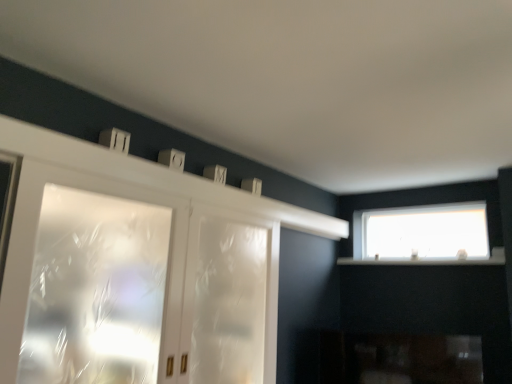
In order to face transparent glass window at upper right, the second window from the front, should I rotate leftwards or rightwards?

To align with it, rotate right about 21.423°.

Where is `frosted glass cabinet at left, which appears as the 1th window when viewed from the left`? frosted glass cabinet at left, which appears as the 1th window when viewed from the left is located at coordinates (95, 290).

Can you confirm if transparent plastic screen door at center is taller than transparent glass window at upper right, the second window from the front?

Correct, transparent plastic screen door at center is much taller as transparent glass window at upper right, the second window from the front.

Is transparent plastic screen door at center in front of or behind transparent glass window at upper right, the first window from the right, in the image?

transparent plastic screen door at center is positioned closer to the viewer than transparent glass window at upper right, the first window from the right.

Is transparent plastic screen door at center beside transparent glass window at upper right, which is the 1th window from back to front?

There is a gap between transparent plastic screen door at center and transparent glass window at upper right, which is the 1th window from back to front.

Is point (227, 311) positioned behind point (374, 258)?

That is False.

How many degrees apart are the facing directions of frosted glass cabinet at left, which appears as the 1th window when viewed from the left, and transparent glass window at upper right, the second window positioned from the left?

90.5 degrees.

Looking at this image, considering the sizes of objects frosted glass cabinet at left, which appears as the first window when viewed from the front, and transparent glass window at upper right, which is the 1th window from back to front, in the image provided, who is bigger, frosted glass cabinet at left, which appears as the first window when viewed from the front, or transparent glass window at upper right, which is the 1th window from back to front,?

frosted glass cabinet at left, which appears as the first window when viewed from the front, is bigger.

Is frosted glass cabinet at left, the 2th window positioned from the right, oriented towards transparent glass window at upper right, the second window from the front?

No.

Is frosted glass cabinet at left, the 2th window positioned from the right, located outside transparent glass window at upper right, the second window from the front?

That's correct, frosted glass cabinet at left, the 2th window positioned from the right, is outside of transparent glass window at upper right, the second window from the front.

From a real-world perspective, which object stands above the other?

From a 3D spatial view, white matte mantle at upper center is above.

From the image's perspective, which one is positioned higher, white matte mantle at upper center or transparent glass window at upper right, the first window from the right?

white matte mantle at upper center appears higher in the image.

Considering the sizes of objects white matte mantle at upper center and transparent glass window at upper right, the first window from the right, in the image provided, who is wider, white matte mantle at upper center or transparent glass window at upper right, the first window from the right,?

With larger width is white matte mantle at upper center.

How much distance is there between white matte mantle at upper center and transparent glass window at upper right, the second window positioned from the left?

They are 1.08 meters apart.

Is frosted glass cabinet at left, acting as the second window starting from the back, inside the boundaries of white matte mantle at upper center, or outside?

frosted glass cabinet at left, acting as the second window starting from the back, lies outside white matte mantle at upper center.

Does frosted glass cabinet at left, the 2th window positioned from the right, have a greater width compared to white matte mantle at upper center?

No.

Identify the location of mantle that appears above the frosted glass cabinet at left, which appears as the 1th window when viewed from the left (from a real-world perspective). (x=155, y=176).

Who is taller, frosted glass cabinet at left, acting as the second window starting from the back, or white matte mantle at upper center?

With more height is frosted glass cabinet at left, acting as the second window starting from the back.

Does point (103, 166) come in front of point (137, 248)?

Yes, it is in front of point (137, 248).

Between white matte mantle at upper center and frosted glass cabinet at left, which appears as the first window when viewed from the front, which one has more height?

Standing taller between the two is frosted glass cabinet at left, which appears as the first window when viewed from the front.

From the picture: Is transparent glass window at upper right, the second window positioned from the left, wider or thinner than frosted glass cabinet at left, acting as the second window starting from the back?

In the image, transparent glass window at upper right, the second window positioned from the left, appears to be more narrow than frosted glass cabinet at left, acting as the second window starting from the back.

How different are the orientations of transparent glass window at upper right, the second window positioned from the left, and frosted glass cabinet at left, which appears as the 1th window when viewed from the left, in degrees?

They differ by 90.5 degrees in their facing directions.

From a real-world perspective, between transparent glass window at upper right, the first window from the right, and frosted glass cabinet at left, the 2th window positioned from the right, who is vertically lower?

frosted glass cabinet at left, the 2th window positioned from the right, is physically lower.

Could you tell me if transparent glass window at upper right, which is the 1th window from back to front, is turned towards frosted glass cabinet at left, which appears as the first window when viewed from the front?

Yes, transparent glass window at upper right, which is the 1th window from back to front, is turned towards frosted glass cabinet at left, which appears as the first window when viewed from the front.

Is frosted glass cabinet at left, which appears as the first window when viewed from the front, to the left or to the right of transparent plastic screen door at center in the image?

Clearly, frosted glass cabinet at left, which appears as the first window when viewed from the front, is on the left of transparent plastic screen door at center in the image.

From a real-world perspective, is frosted glass cabinet at left, the 2th window positioned from the right, beneath transparent plastic screen door at center?

No, from a real-world perspective, frosted glass cabinet at left, the 2th window positioned from the right, is not below transparent plastic screen door at center.

Between frosted glass cabinet at left, which appears as the 1th window when viewed from the left, and transparent plastic screen door at center, which one has larger size?

transparent plastic screen door at center.

What are the coordinates of `screen door that appears on the left of transparent glass window at upper right, the second window from the front` in the screenshot? It's located at (229, 298).

What are the coordinates of `window lying above the frosted glass cabinet at left, the 2th window positioned from the right (from the image's perspective)` in the screenshot? It's located at (422, 233).

Estimate the real-world distances between objects in this image. Which object is closer to frosted glass cabinet at left, which appears as the first window when viewed from the front, transparent glass window at upper right, the first window from the right, or white matte mantle at upper center?

white matte mantle at upper center lies closer to frosted glass cabinet at left, which appears as the first window when viewed from the front, than the other object.

Estimate the real-world distances between objects in this image. Which object is further from white matte mantle at upper center, frosted glass cabinet at left, which appears as the 1th window when viewed from the left, or transparent glass window at upper right, the second window positioned from the left?

Among the two, transparent glass window at upper right, the second window positioned from the left, is located further to white matte mantle at upper center.

Consider the image. Looking at the image, which one is located closer to white matte mantle at upper center, transparent plastic screen door at center or frosted glass cabinet at left, the 2th window positioned from the right?

transparent plastic screen door at center lies closer to white matte mantle at upper center than the other object.

Considering their positions, is frosted glass cabinet at left, acting as the second window starting from the back, positioned closer to white matte mantle at upper center than transparent plastic screen door at center?

transparent plastic screen door at center.

Estimate the real-world distances between objects in this image. Which object is closer to white matte mantle at upper center, transparent plastic screen door at center or transparent glass window at upper right, which is the 1th window from back to front?

Based on the image, transparent plastic screen door at center appears to be nearer to white matte mantle at upper center.

Considering their positions, is white matte mantle at upper center positioned further to transparent glass window at upper right, the second window positioned from the left, than transparent plastic screen door at center?

Based on the image, transparent plastic screen door at center appears to be further to transparent glass window at upper right, the second window positioned from the left.

Which object lies further to the anchor point transparent plastic screen door at center, white matte mantle at upper center or transparent glass window at upper right, the first window from the right?

transparent glass window at upper right, the first window from the right, lies further to transparent plastic screen door at center than the other object.

From the image, which object appears to be nearer to frosted glass cabinet at left, which appears as the first window when viewed from the front, transparent glass window at upper right, which is the 1th window from back to front, or transparent plastic screen door at center?

transparent plastic screen door at center is closer to frosted glass cabinet at left, which appears as the first window when viewed from the front.

Locate an element on the screen. screen door situated between frosted glass cabinet at left, which appears as the 1th window when viewed from the left, and transparent glass window at upper right, the second window positioned from the left, from left to right is located at coordinates (229, 298).

Image resolution: width=512 pixels, height=384 pixels. I want to click on mantle between frosted glass cabinet at left, the 2th window positioned from the right, and transparent plastic screen door at center in the front-back direction, so click(x=155, y=176).

Find the location of a particular element. mantle located between transparent plastic screen door at center and transparent glass window at upper right, the second window from the front, in the left-right direction is located at coordinates (155, 176).

Identify the location of mantle situated between frosted glass cabinet at left, the 2th window positioned from the right, and transparent glass window at upper right, the second window from the front, from left to right. (155, 176).